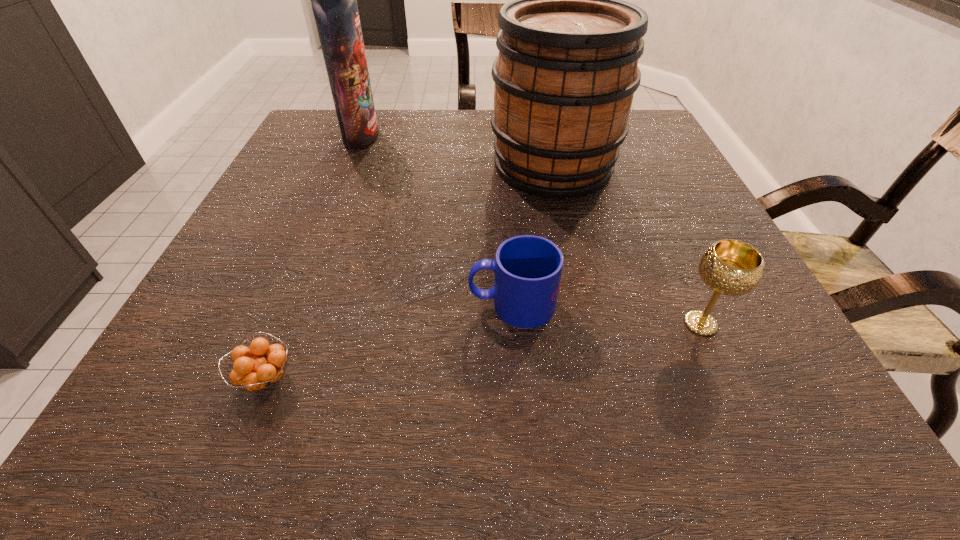
In order to click on shampoo in this screenshot , I will do `click(334, 0)`.

Locate an element on the screen. cider is located at coordinates (567, 69).

At what (x,y) coordinates should I click in order to perform the action: click on the third tallest object. Please return your answer as a coordinate pair (x, y). This screenshot has width=960, height=540. Looking at the image, I should click on (730, 267).

This screenshot has height=540, width=960. Identify the location of mug. (528, 268).

Find the location of `the nearest object`. the nearest object is located at coordinates (258, 373).

Where is `orange fruit`? orange fruit is located at coordinates (258, 373).

Identify the location of vacant space positioned on the front label of the shampoo. (529, 137).

Identify the location of vacant area located on the front of the fourth shortest object. This screenshot has width=960, height=540. (592, 343).

Find the location of a particular element. The image size is (960, 540). vacant space situated on the left of the third tallest object is located at coordinates (439, 323).

Where is `vacant space located 0.170m on the side with the handle of the second shortest object`? The image size is (960, 540). vacant space located 0.170m on the side with the handle of the second shortest object is located at coordinates (361, 305).